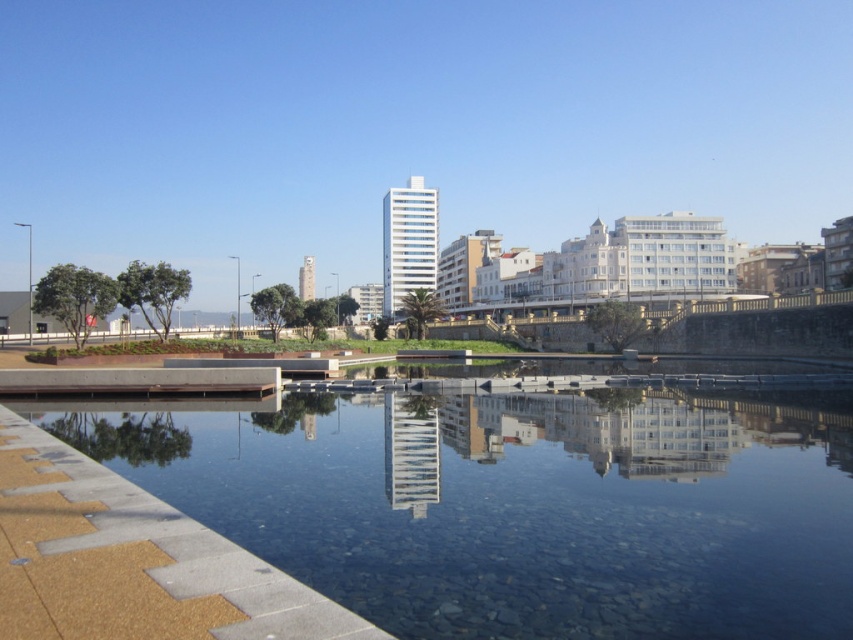
Is smooth concrete river at center thinner than brown textured paving at lower left?

In fact, smooth concrete river at center might be wider than brown textured paving at lower left.

Where is `smooth concrete river at center`? Image resolution: width=853 pixels, height=640 pixels. smooth concrete river at center is located at coordinates (517, 502).

At what (x,y) coordinates should I click in order to perform the action: click on smooth concrete river at center. Please return your answer as a coordinate pair (x, y). The image size is (853, 640). Looking at the image, I should click on (517, 502).